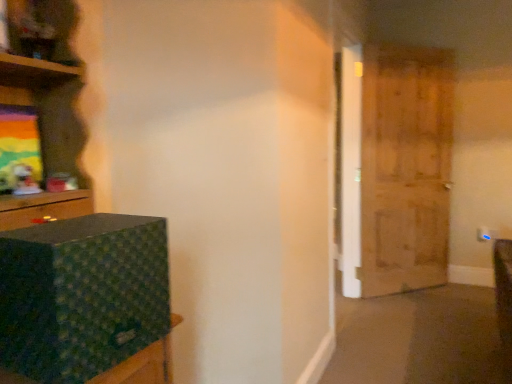
Question: Can you confirm if green fabric box at left is smaller than wooden door at right?

Choices:
 (A) yes
 (B) no

Answer: (A)

Question: From a real-world perspective, is green fabric box at left on top of wooden door at right?

Choices:
 (A) no
 (B) yes

Answer: (A)

Question: Can you confirm if green fabric box at left is bigger than wooden door at right?

Choices:
 (A) yes
 (B) no

Answer: (B)

Question: Is green fabric box at left positioned with its back to wooden door at right?

Choices:
 (A) yes
 (B) no

Answer: (B)

Question: Is green fabric box at left not close to wooden door at right?

Choices:
 (A) no
 (B) yes

Answer: (B)

Question: Is green fabric box at left oriented towards wooden door at right?

Choices:
 (A) yes
 (B) no

Answer: (B)

Question: From a real-world perspective, is wooden door at right physically above green fabric box at left?

Choices:
 (A) yes
 (B) no

Answer: (A)

Question: Can you confirm if wooden door at right is shorter than green fabric box at left?

Choices:
 (A) yes
 (B) no

Answer: (B)

Question: Considering the relative sizes of wooden door at right and green fabric box at left in the image provided, is wooden door at right thinner than green fabric box at left?

Choices:
 (A) no
 (B) yes

Answer: (B)

Question: Is the depth of wooden door at right less than that of green fabric box at left?

Choices:
 (A) no
 (B) yes

Answer: (A)

Question: Is wooden door at right oriented away from green fabric box at left?

Choices:
 (A) yes
 (B) no

Answer: (B)

Question: Considering the relative positions of wooden door at right and green fabric box at left in the image provided, is wooden door at right to the left of green fabric box at left from the viewer's perspective?

Choices:
 (A) yes
 (B) no

Answer: (B)

Question: In the image, is wooden door at right positioned in front of or behind green fabric box at left?

Choices:
 (A) behind
 (B) front

Answer: (A)